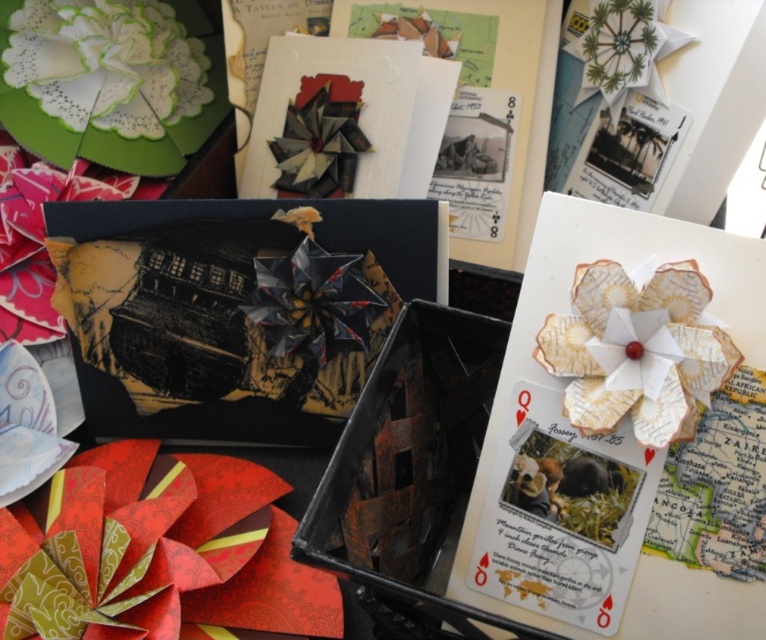
Question: Is map paper flower at upper right in front of white paper flower at upper left?

Choices:
 (A) no
 (B) yes

Answer: (B)

Question: Which point appears farthest from the camera in this image?

Choices:
 (A) (470, 586)
 (B) (115, 67)

Answer: (B)

Question: Which point is farther to the camera?

Choices:
 (A) white paper postcard at center
 (B) map paper flower at upper right

Answer: (A)

Question: Considering the relative positions of red paper flower at lower left and white paper flower at upper left in the image provided, where is red paper flower at lower left located with respect to white paper flower at upper left?

Choices:
 (A) right
 (B) left

Answer: (A)

Question: Which object appears farthest from the camera in this image?

Choices:
 (A) map paper flower at upper right
 (B) white paper flower at upper left
 (C) red paper flower at lower left
 (D) white paper postcard at center

Answer: (B)

Question: Where is white paper postcard at center located in relation to white paper flower at upper left in the image?

Choices:
 (A) above
 (B) below

Answer: (B)